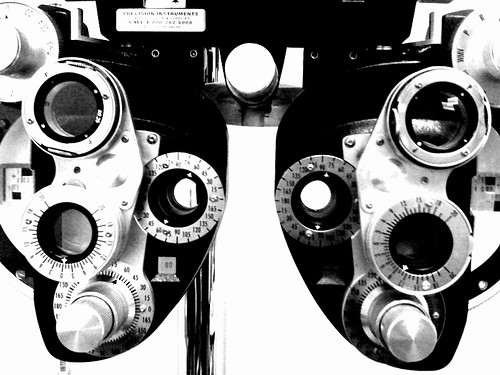
What are the coordinates of `knob` in the screenshot? It's located at (76, 311), (400, 337).